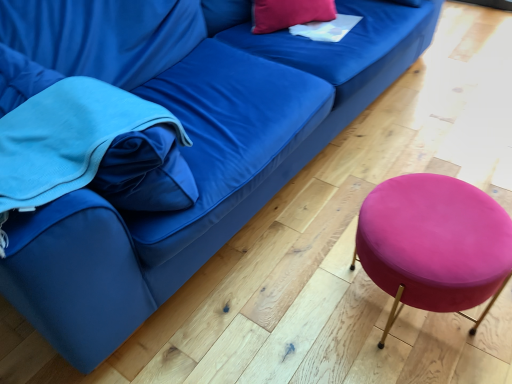
Question: Does matte pink pillow at upper center have a lesser width compared to velvet pink stool at lower right?

Choices:
 (A) no
 (B) yes

Answer: (B)

Question: Would you say matte pink pillow at upper center contains velvet pink stool at lower right?

Choices:
 (A) yes
 (B) no

Answer: (B)

Question: Does matte pink pillow at upper center turn towards velvet pink stool at lower right?

Choices:
 (A) yes
 (B) no

Answer: (B)

Question: From a real-world perspective, is matte pink pillow at upper center on top of velvet pink stool at lower right?

Choices:
 (A) no
 (B) yes

Answer: (B)

Question: Considering the relative sizes of matte pink pillow at upper center and velvet pink stool at lower right in the image provided, is matte pink pillow at upper center shorter than velvet pink stool at lower right?

Choices:
 (A) yes
 (B) no

Answer: (A)

Question: Can you confirm if matte pink pillow at upper center is smaller than velvet pink stool at lower right?

Choices:
 (A) no
 (B) yes

Answer: (B)

Question: From a real-world perspective, is velvet pink stool at lower right positioned under matte pink pillow at upper center based on gravity?

Choices:
 (A) yes
 (B) no

Answer: (A)

Question: Is velvet pink stool at lower right at the right side of matte pink pillow at upper center?

Choices:
 (A) no
 (B) yes

Answer: (B)

Question: Is velvet pink stool at lower right with matte pink pillow at upper center?

Choices:
 (A) no
 (B) yes

Answer: (A)

Question: Is velvet pink stool at lower right smaller than matte pink pillow at upper center?

Choices:
 (A) yes
 (B) no

Answer: (B)

Question: Considering the relative sizes of velvet pink stool at lower right and matte pink pillow at upper center in the image provided, is velvet pink stool at lower right taller than matte pink pillow at upper center?

Choices:
 (A) yes
 (B) no

Answer: (A)

Question: Can you confirm if velvet pink stool at lower right is wider than matte pink pillow at upper center?

Choices:
 (A) yes
 (B) no

Answer: (A)

Question: In the image, is velvet pink stool at lower right positioned in front of or behind matte pink pillow at upper center?

Choices:
 (A) behind
 (B) front

Answer: (B)